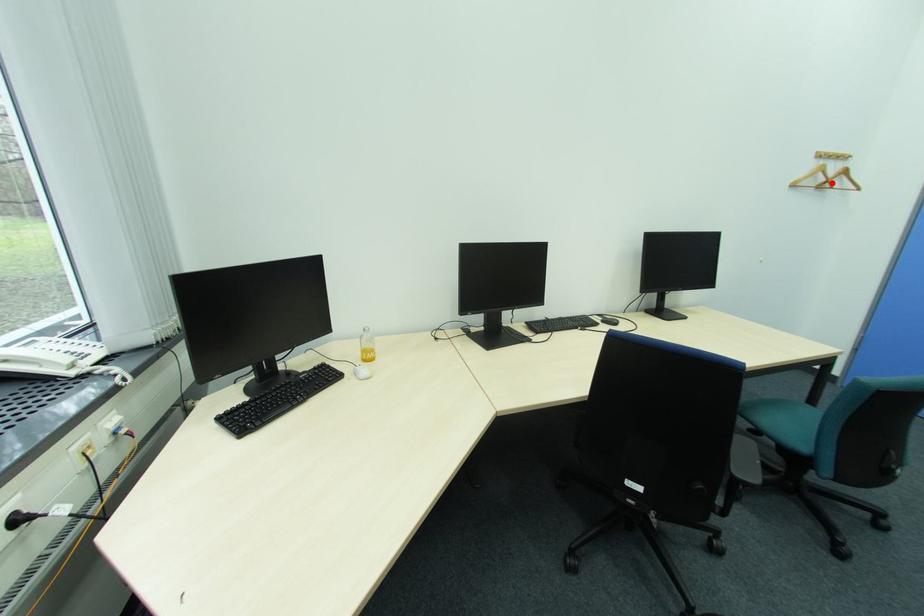
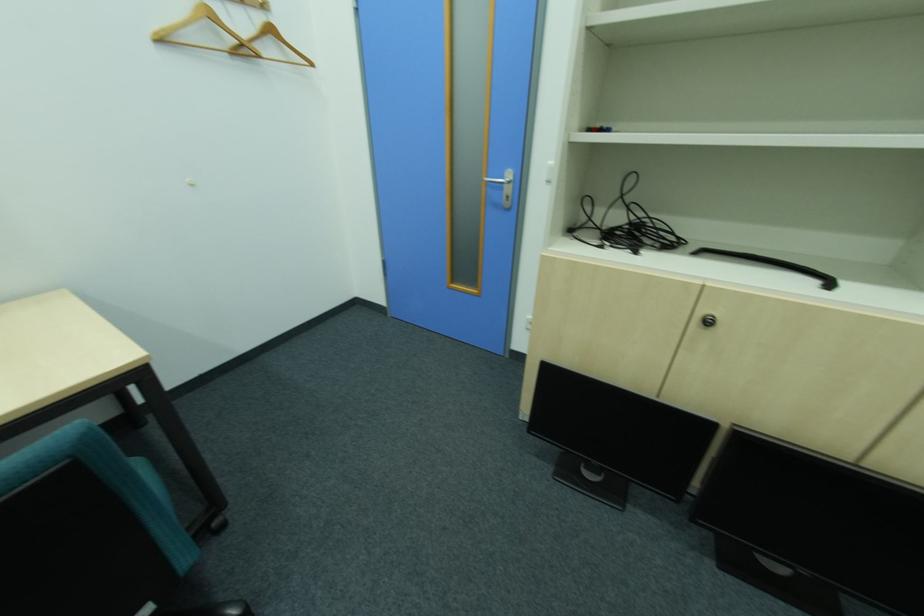
Question: I am providing you with two images of the same scene from different viewpoints. Image1 has a red point marked. In image2, the corresponding 3D location appears at what relative position? Reply with the corresponding letter.

Choices:
 (A) Closer
 (B) Farther

Answer: (A)